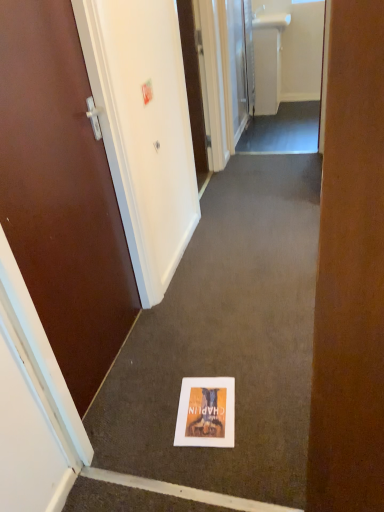
Question: Is matte paper flyer at center aimed at brown wooden door at left, positioned as the 2th door in back-to-front order?

Choices:
 (A) yes
 (B) no

Answer: (B)

Question: Considering the relative sizes of matte paper flyer at center and brown wooden door at left, positioned as the 2th door in back-to-front order, in the image provided, is matte paper flyer at center shorter than brown wooden door at left, positioned as the 2th door in back-to-front order,?

Choices:
 (A) no
 (B) yes

Answer: (B)

Question: Considering the relative sizes of matte paper flyer at center and brown wooden door at left, positioned as the first door in front-to-back order, in the image provided, is matte paper flyer at center wider than brown wooden door at left, positioned as the first door in front-to-back order,?

Choices:
 (A) yes
 (B) no

Answer: (A)

Question: Is brown wooden door at left, placed as the 1th door when sorted from left to right, located within matte paper flyer at center?

Choices:
 (A) yes
 (B) no

Answer: (B)

Question: Can you confirm if matte paper flyer at center is thinner than brown wooden door at left, placed as the second door when sorted from top to bottom?

Choices:
 (A) no
 (B) yes

Answer: (A)

Question: Is matte paper flyer at center positioned behind brown wooden door at left, placed as the second door when sorted from top to bottom?

Choices:
 (A) no
 (B) yes

Answer: (B)

Question: Is white glossy door at upper center, the 1th door from the top, positioned with its back to matte paper flyer at center?

Choices:
 (A) no
 (B) yes

Answer: (A)

Question: From the image's perspective, is white glossy door at upper center, which is the second door in left-to-right order, over matte paper flyer at center?

Choices:
 (A) no
 (B) yes

Answer: (B)

Question: Considering the relative positions of white glossy door at upper center, which is the second door from front to back, and matte paper flyer at center in the image provided, is white glossy door at upper center, which is the second door from front to back, behind matte paper flyer at center?

Choices:
 (A) no
 (B) yes

Answer: (B)

Question: Is white glossy door at upper center, the 1th door positioned from the right, outside matte paper flyer at center?

Choices:
 (A) yes
 (B) no

Answer: (A)

Question: Is the position of white glossy door at upper center, which is the second door from front to back, less distant than that of matte paper flyer at center?

Choices:
 (A) yes
 (B) no

Answer: (B)

Question: Can you confirm if white glossy door at upper center, the 1th door from the top, is positioned to the right of matte paper flyer at center?

Choices:
 (A) no
 (B) yes

Answer: (B)

Question: Is white plastic sink at upper center not close to matte paper flyer at center?

Choices:
 (A) yes
 (B) no

Answer: (A)